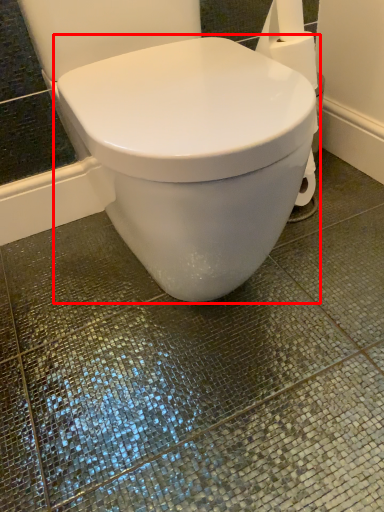
Question: From the image's perspective, considering the relative positions of toilet (annotated by the red box) and toilet paper in the image provided, where is toilet (annotated by the red box) located with respect to the staircase?

Choices:
 (A) below
 (B) above

Answer: (A)